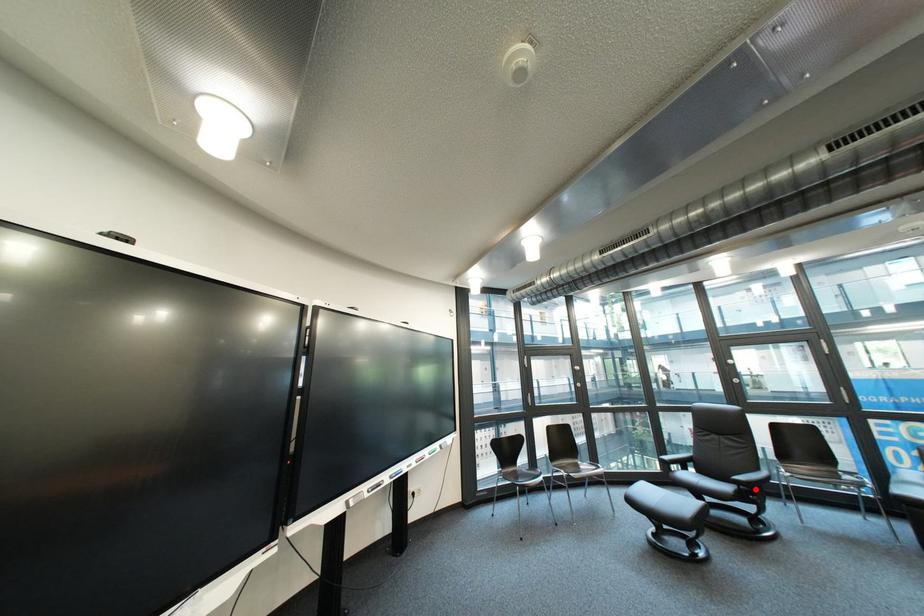
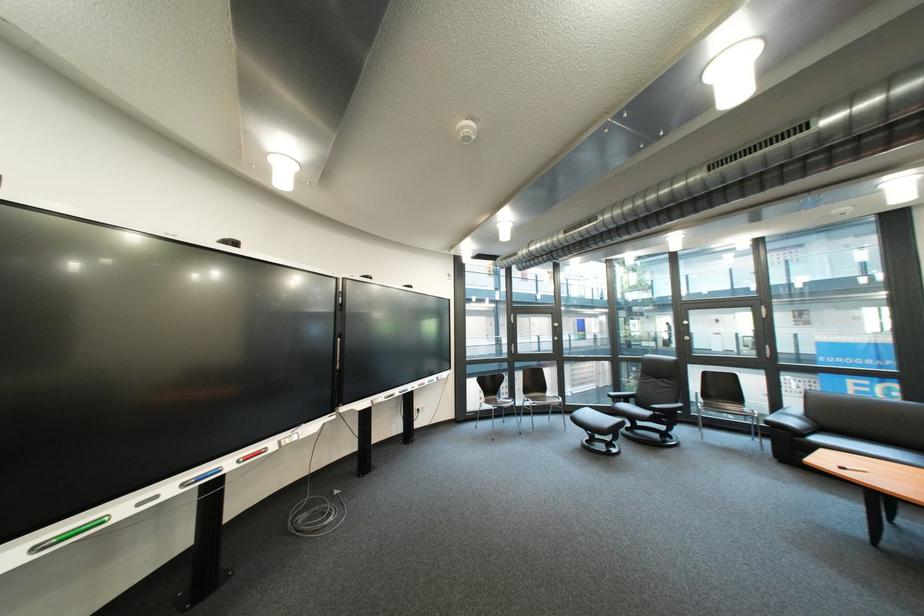
Question: I am providing you with two images of the same scene from different viewpoints. Image1 has a red point marked. In image2, the corresponding 3D location appears at what relative position? Reply with the corresponding letter.

Choices:
 (A) Closer
 (B) Farther

Answer: (B)